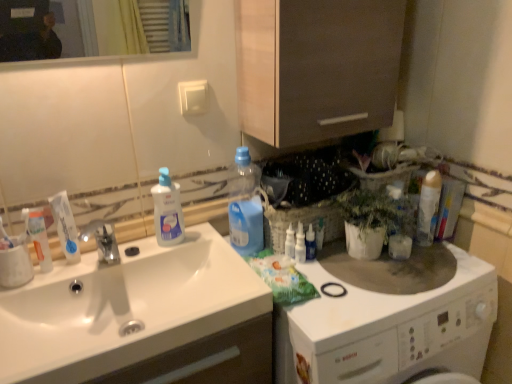
Where is `vacant area located to the right-hand side of transparent plastic bottle at upper right`? vacant area located to the right-hand side of transparent plastic bottle at upper right is located at coordinates (360, 265).